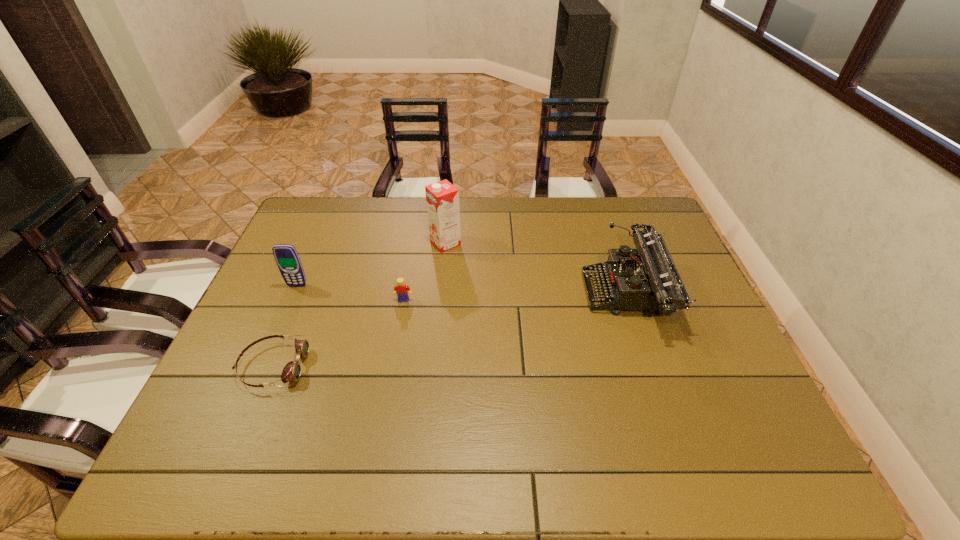
Identify the location of vacant space at the left edge of the desktop. This screenshot has width=960, height=540. (271, 397).

In the image, there is a desktop. At what (x,y) coordinates should I click in order to perform the action: click on vacant space at the right edge. Please return your answer as a coordinate pair (x, y). This screenshot has width=960, height=540. Looking at the image, I should click on (665, 339).

The height and width of the screenshot is (540, 960). In the image, there is a desktop. Identify the location of free space at the far left corner. (333, 227).

This screenshot has width=960, height=540. Identify the location of free space between the goggles and the cellular telephone. (285, 326).

You are a GUI agent. You are given a task and a screenshot of the screen. Output one action in this format:
    pyautogui.click(x=<x>, y=<y>)
    Task: Click on the blank region between the rightmost object and the cellular telephone
    The height and width of the screenshot is (540, 960).
    Given the screenshot: What is the action you would take?
    pyautogui.click(x=462, y=290)

The image size is (960, 540). Find the location of `vacant region between the rightmost object and the farthest object`. vacant region between the rightmost object and the farthest object is located at coordinates (536, 269).

Identify the location of vacant area between the goggles and the cellular telephone. (285, 326).

Image resolution: width=960 pixels, height=540 pixels. I want to click on free area in between the Lego and the cellular telephone, so click(x=350, y=293).

Find the location of a particular element. blank region between the shortest object and the cellular telephone is located at coordinates (285, 326).

The width and height of the screenshot is (960, 540). In order to click on unoccupied area between the Lego and the rightmost object in this screenshot , I will do `click(516, 297)`.